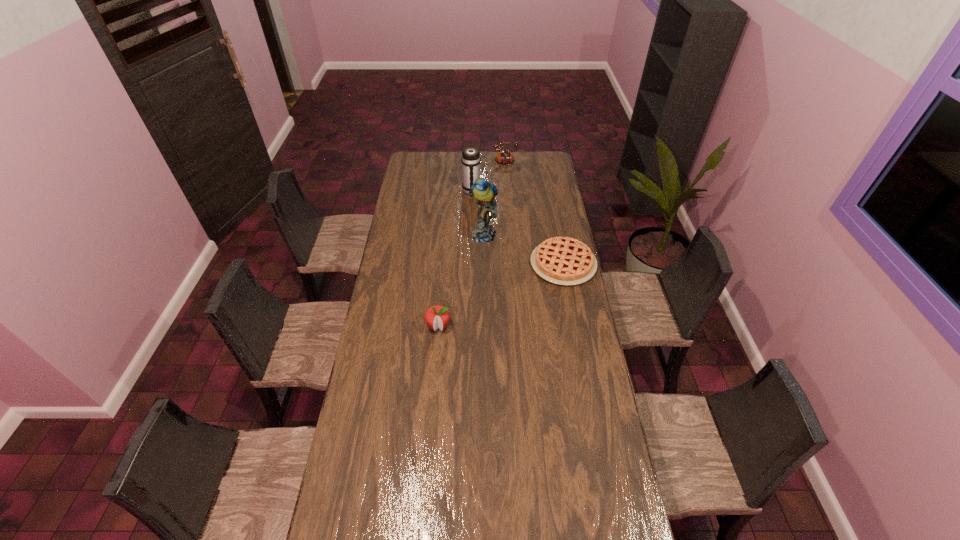
The width and height of the screenshot is (960, 540). I want to click on vacant space in between the pie and the nearest object, so click(x=501, y=295).

The width and height of the screenshot is (960, 540). In order to click on empty space between the tallest object and the leftmost object in this screenshot , I will do `click(461, 280)`.

Find the location of a particular element. vacant area that lies between the tallest object and the pie is located at coordinates (523, 249).

Find the location of a particular element. The width and height of the screenshot is (960, 540). blank region between the pie and the telephone is located at coordinates (529, 213).

Identify which object is the second nearest to the second farthest object. Please provide its 2D coordinates. Your answer should be formatted as a tuple, i.e. [(x, y)], where the tuple contains the x and y coordinates of a point satisfying the conditions above.

[(483, 192)]

Locate which object is the second closest to the parrot. Please provide its 2D coordinates. Your answer should be formatted as a tuple, i.e. [(x, y)], where the tuple contains the x and y coordinates of a point satisfying the conditions above.

[(470, 160)]

Find the location of `free location that satisfies the following two spatial constraints: 1. on the back side of the telephone; 2. on the right side of the parrot`. free location that satisfies the following two spatial constraints: 1. on the back side of the telephone; 2. on the right side of the parrot is located at coordinates (483, 161).